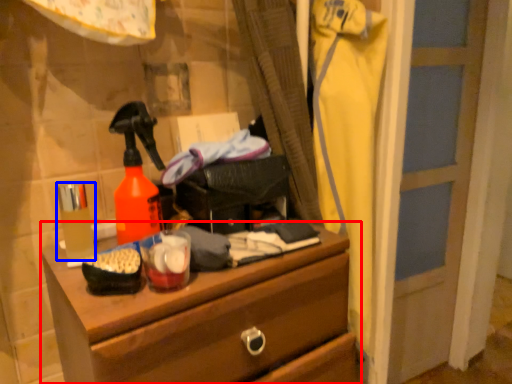
Question: Which of the following is the closest to the observer, chest of drawers (highlighted by a red box) or toiletry (highlighted by a blue box)?

Choices:
 (A) chest of drawers
 (B) toiletry

Answer: (A)